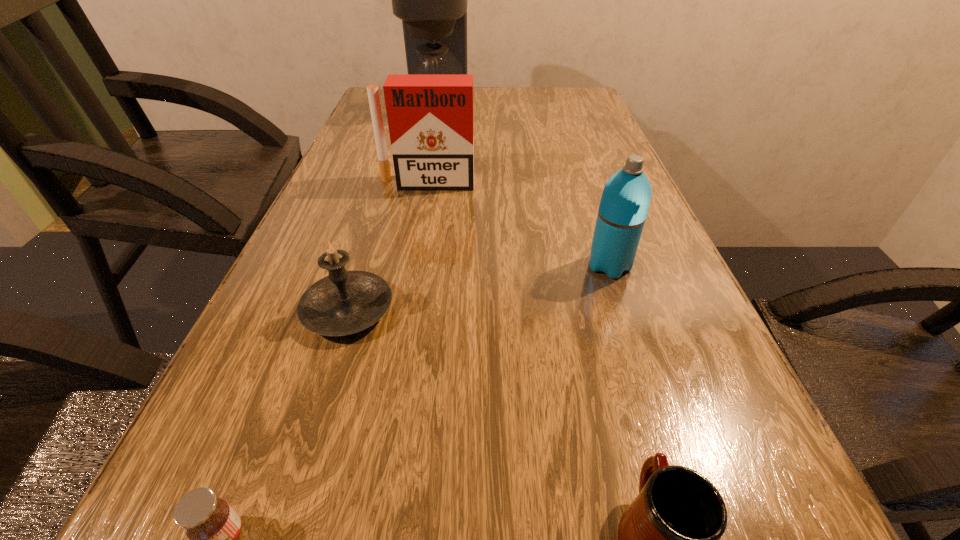
Identify the location of free point between the coffee maker and the candle. The height and width of the screenshot is (540, 960). (393, 211).

You are a GUI agent. You are given a task and a screenshot of the screen. Output one action in this format:
    pyautogui.click(x=<x>, y=<y>)
    Task: Click on the free space between the thermos bottle and the cigarette case
    
    Given the screenshot: What is the action you would take?
    pyautogui.click(x=518, y=225)

Where is `vacant area that lies between the candle and the tallest object`? This screenshot has height=540, width=960. vacant area that lies between the candle and the tallest object is located at coordinates (393, 211).

I want to click on empty location between the thermos bottle and the tallest object, so click(x=524, y=190).

This screenshot has width=960, height=540. Find the location of `empty location between the thermos bottle and the candle`. empty location between the thermos bottle and the candle is located at coordinates (478, 288).

Find the location of a particular element. Image resolution: width=960 pixels, height=540 pixels. object that stands as the second closest to the second shortest object is located at coordinates (345, 302).

Locate which object ranks second in proximity to the second farthest object. Please provide its 2D coordinates. Your answer should be formatted as a tuple, i.e. [(x, y)], where the tuple contains the x and y coordinates of a point satisfying the conditions above.

[(345, 302)]

At what (x,y) coordinates should I click in order to perform the action: click on blank area in the image that satisfies the following two spatial constraints: 1. on the button side of the thermos bottle; 2. on the left side of the coffee maker. Please return your answer as a coordinate pair (x, y). This screenshot has height=540, width=960. Looking at the image, I should click on (411, 266).